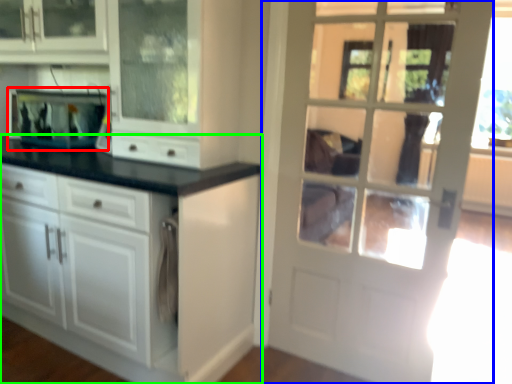
Question: Considering the real-world distances, which object is closest to appliance (highlighted by a red box)? door (highlighted by a blue box) or cabinetry (highlighted by a green box).

Choices:
 (A) door
 (B) cabinetry

Answer: (B)